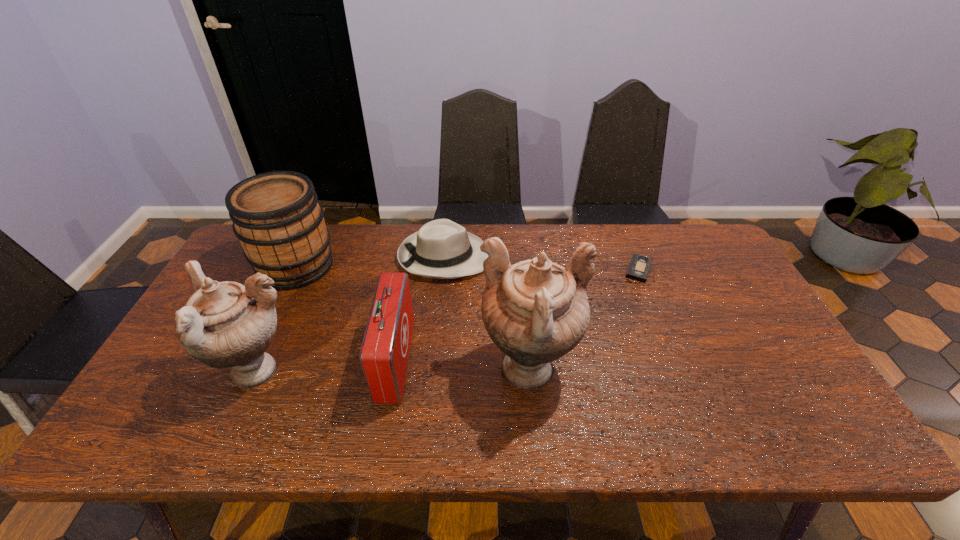
Please show where to add a urn on the right while keeping spacing even. Please provide its 2D coordinates. Your answer should be formatted as a tuple, i.e. [(x, y)], where the tuple contains the x and y coordinates of a point satisfying the conditions above.

[(802, 371)]